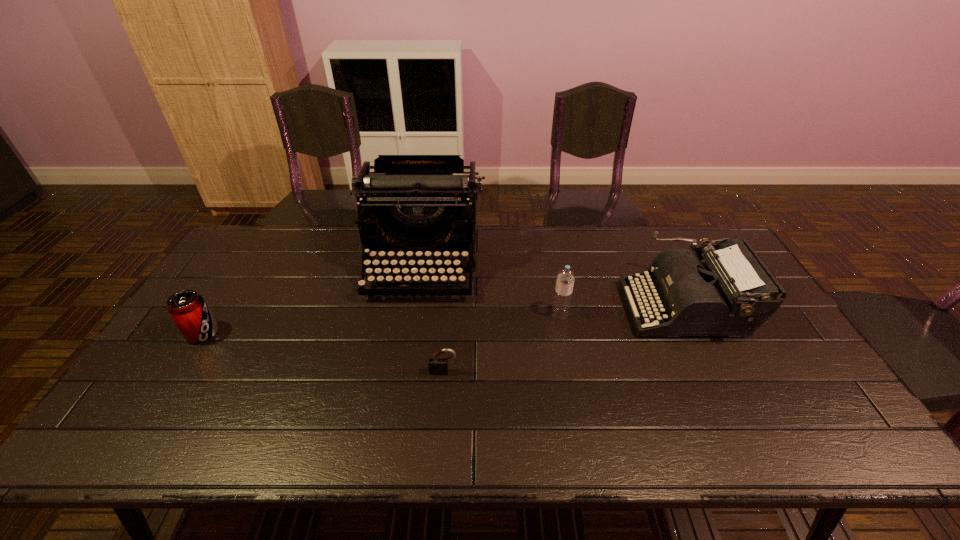
What are the coordinates of `the tallest object` in the screenshot? It's located at (413, 202).

Locate an element on the screen. The width and height of the screenshot is (960, 540). the left typewriter is located at coordinates (413, 202).

Where is `the second object from right to left`? This screenshot has width=960, height=540. the second object from right to left is located at coordinates pos(565,280).

What are the coordinates of `the shorter typewriter` in the screenshot? It's located at (733, 293).

This screenshot has width=960, height=540. Identify the location of the right typewriter. (733, 293).

I want to click on the second shortest object, so click(x=188, y=309).

The height and width of the screenshot is (540, 960). Identify the location of the leftmost object. (188, 309).

Identify the location of the nearest object. This screenshot has height=540, width=960. (437, 365).

The height and width of the screenshot is (540, 960). Identify the location of padlock. (437, 365).

You are a GUI agent. You are given a task and a screenshot of the screen. Output one action in this format:
    pyautogui.click(x=<x>, y=<y>)
    Task: Click on the vacant space positioned on the typing side of the tallest object
    The width and height of the screenshot is (960, 540).
    Given the screenshot: What is the action you would take?
    pyautogui.click(x=413, y=329)